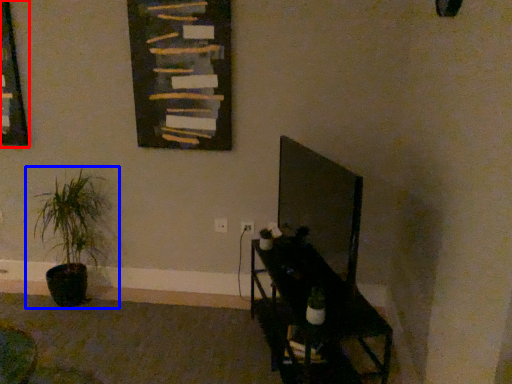
Question: Which of the following is the closest to the observer, picture frame (highlighted by a red box) or houseplant (highlighted by a blue box)?

Choices:
 (A) picture frame
 (B) houseplant

Answer: (B)